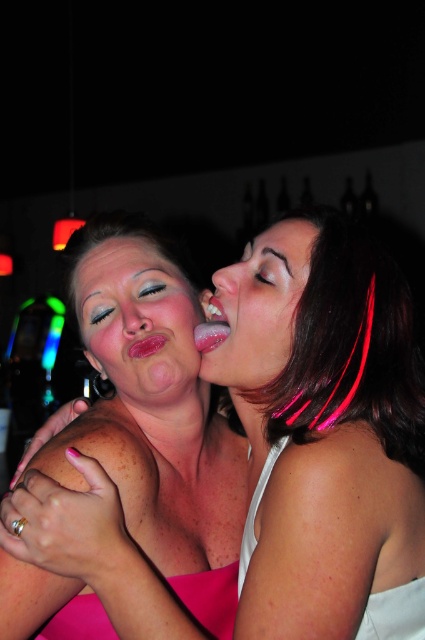
Question: Considering the real-world distances, which object is closest to the white satin dress at shoulder?

Choices:
 (A) pink glossy lips at center
 (B) shiny pink lips at center

Answer: (B)

Question: Does pink matte skin at center have a greater width compared to pink glossy lips at center?

Choices:
 (A) yes
 (B) no

Answer: (A)

Question: Can you confirm if satin skin face at center is bigger than shiny pink lips at center?

Choices:
 (A) yes
 (B) no

Answer: (A)

Question: In this image, where is satin skin face at center located relative to pink glossy lips at center?

Choices:
 (A) right
 (B) left

Answer: (A)

Question: Which is farther from the pink glossy lips at center?

Choices:
 (A) shiny pink lips at center
 (B) pink satin dress at center

Answer: (B)

Question: Which point appears farthest from the camera in this image?

Choices:
 (A) (215, 326)
 (B) (133, 353)
 (C) (269, 385)
 (D) (257, 237)

Answer: (D)